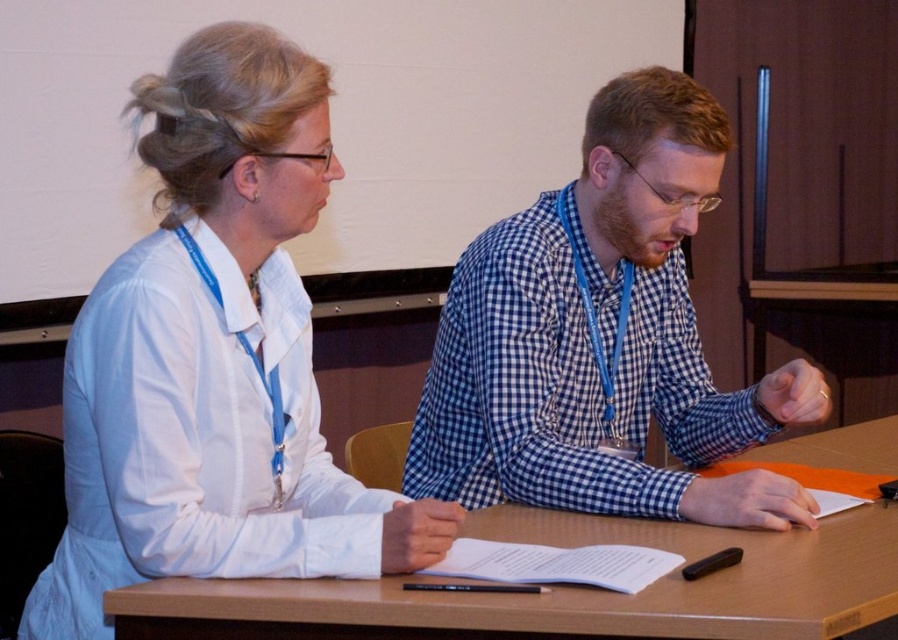
Does white smooth shirt at upper left have a lesser height compared to wooden table at center?

No.

Based on the photo, is white smooth shirt at upper left further to camera compared to wooden table at center?

Yes, it is behind wooden table at center.

Describe the element at coordinates (216, 358) in the screenshot. I see `white smooth shirt at upper left` at that location.

You are a GUI agent. You are given a task and a screenshot of the screen. Output one action in this format:
    pyautogui.click(x=<x>, y=<y>)
    Task: Click on the white smooth shirt at upper left
    The image size is (898, 640).
    Given the screenshot: What is the action you would take?
    pyautogui.click(x=216, y=358)

Is point (458, 426) behind point (764, 538)?

Yes.

Is point (753, 524) closer to camera compared to point (180, 621)?

No, it is behind (180, 621).

What are the coordinates of `blue checkered shirt at center` in the screenshot? It's located at (602, 339).

Is point (151, 250) farther from viewer compared to point (494, 339)?

No.

Does point (342, 493) come closer to viewer compared to point (645, 294)?

Yes, point (342, 493) is in front of point (645, 294).

Which is behind, point (120, 506) or point (645, 97)?

Point (645, 97)

Identify the location of white smooth shirt at upper left. (216, 358).